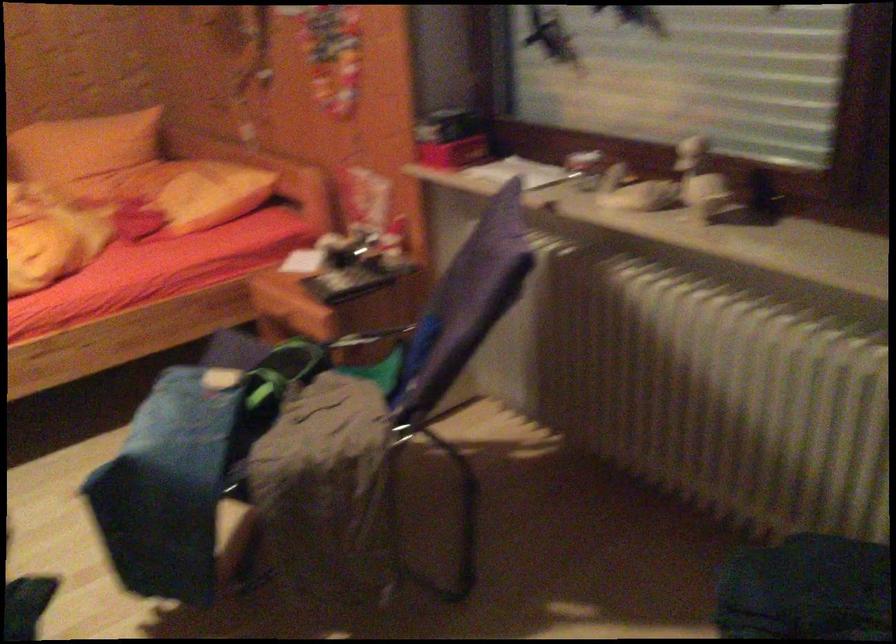
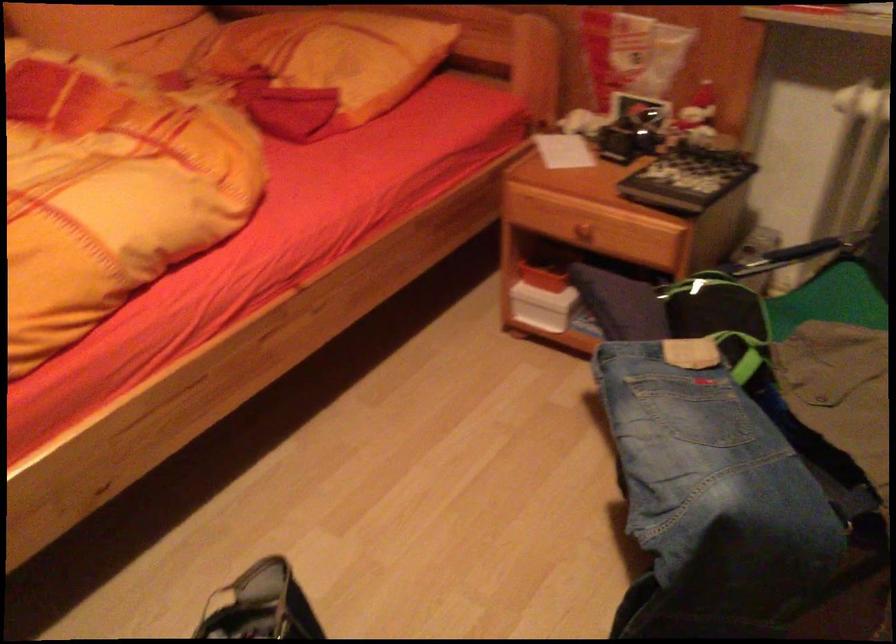
Based on the photo, the images are taken continuously from a first-person perspective. In which direction are you moving?

The cameraman moved toward left, forward.